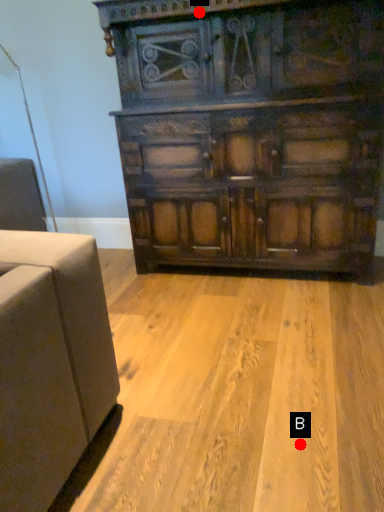
Question: Two points are circled on the image, labeled by A and B beside each circle. Which point is closer to the camera taking this photo?

Choices:
 (A) A is closer
 (B) B is closer

Answer: (B)